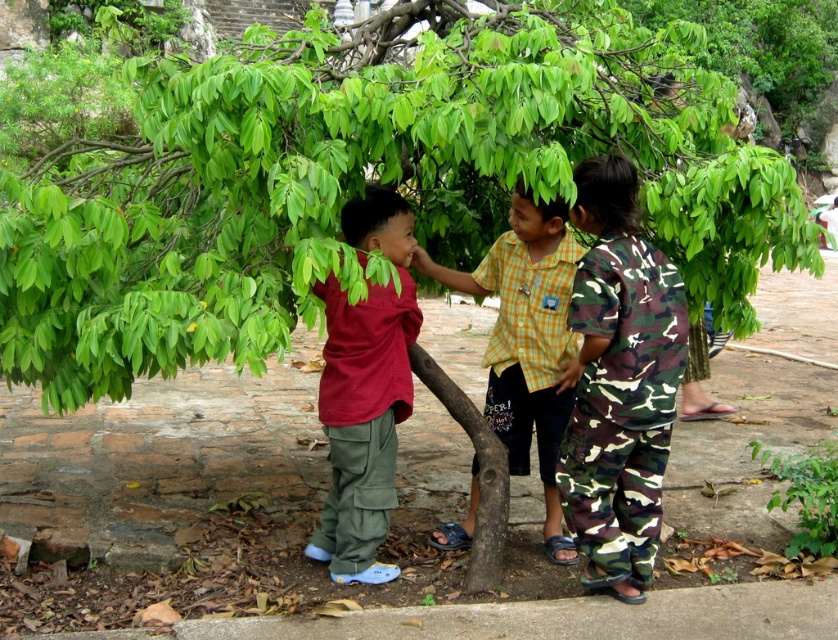
Between point (379, 369) and point (544, 440), which one is positioned in front?

Point (379, 369) is in front.

Is point (386, 493) more distant than point (572, 243)?

No, it is not.

Identify the location of matte red shirt at center. (365, 390).

Which is more to the right, green leafy tree at center or camouflage pants at right?

camouflage pants at right is more to the right.

Where is `green leafy tree at center`? green leafy tree at center is located at coordinates pos(361,182).

Which is in front, point (593, 132) or point (652, 556)?

Point (652, 556)

Find the location of a particular element. This screenshot has width=838, height=640. green leafy tree at center is located at coordinates (361, 182).

Who is more distant from viewer, (627,396) or (521,232)?

Point (521,232)

Consider the image. Which is below, camouflage pants at right or yellow checkered shirt at center?

camouflage pants at right is lower down.

Describe the element at coordinates (622, 404) in the screenshot. I see `camouflage pants at right` at that location.

Find the location of a particular element. This screenshot has height=640, width=838. camouflage pants at right is located at coordinates (622, 404).